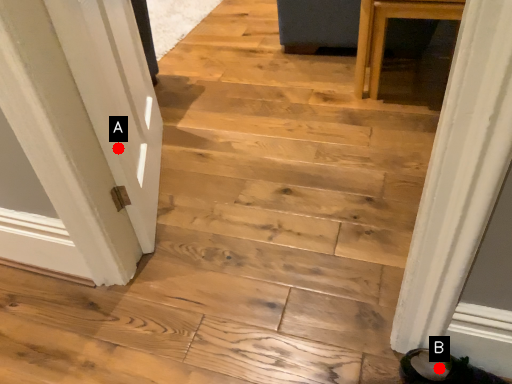
Question: Two points are circled on the image, labeled by A and B beside each circle. Which of the following is the farthest from the observer?

Choices:
 (A) A is further
 (B) B is further

Answer: (A)